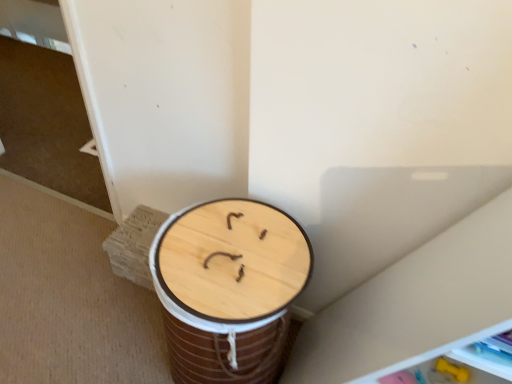
The width and height of the screenshot is (512, 384). What do you see at coordinates (229, 288) in the screenshot?
I see `light wood/texture barrel at center` at bounding box center [229, 288].

This screenshot has width=512, height=384. I want to click on light wood/texture barrel at center, so click(x=229, y=288).

The width and height of the screenshot is (512, 384). I want to click on light wood/texture barrel at center, so click(229, 288).